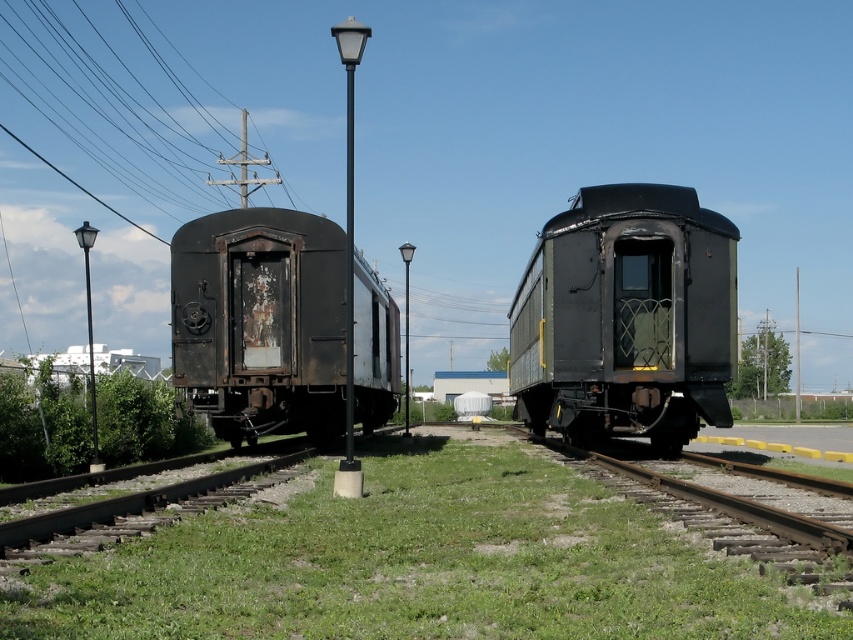
Which is in front, point (105, 552) or point (660, 227)?

Point (105, 552)

Is point (70, 618) closer to camera compared to point (585, 224)?

Yes, point (70, 618) is closer to viewer.

Where is `green grass at center`? The image size is (853, 640). green grass at center is located at coordinates (415, 564).

At what (x,y) coordinates should I click in order to perform the action: click on green grass at center. Please return your answer as a coordinate pair (x, y). Image resolution: width=853 pixels, height=640 pixels. Looking at the image, I should click on (415, 564).

Is point (567, 621) less distant than point (229, 236)?

Yes, point (567, 621) is in front of point (229, 236).

This screenshot has width=853, height=640. What do you see at coordinates (415, 564) in the screenshot? I see `green grass at center` at bounding box center [415, 564].

In order to click on green grass at center in this screenshot , I will do (x=415, y=564).

Which of these two, rusty metal train car at center or rusty metal train car at left, stands taller?

With more height is rusty metal train car at center.

At what (x,y) coordinates should I click in order to perform the action: click on rusty metal train car at center. Please return your answer as a coordinate pair (x, y). Looking at the image, I should click on (625, 317).

Where is `rusty metal train car at center`? The width and height of the screenshot is (853, 640). rusty metal train car at center is located at coordinates (625, 317).